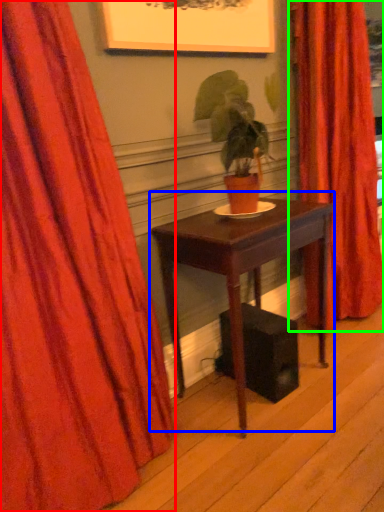
Question: Which object is positioned closest to curtain (highlighted by a red box)? Select from table (highlighted by a blue box) and curtain (highlighted by a green box).

Choices:
 (A) table
 (B) curtain

Answer: (A)